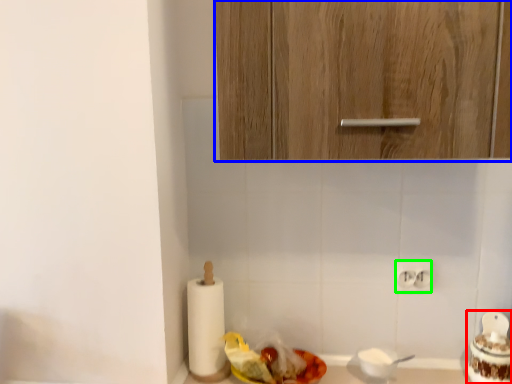
Question: Considering the real-world distances, which object is closest to food (highlighted by a red box)? cabinetry (highlighted by a blue box) or electric outlet (highlighted by a green box).

Choices:
 (A) cabinetry
 (B) electric outlet

Answer: (B)